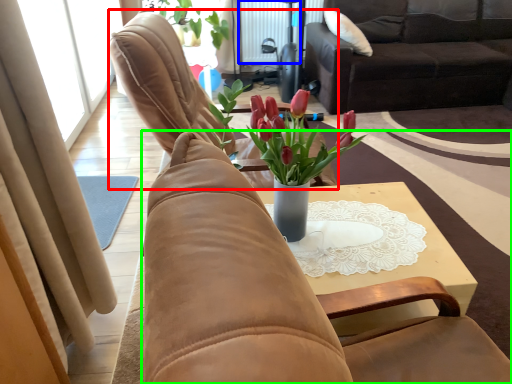
Question: Which object is positioned closest to chair (highlighted by a red box)? Select from radiator (highlighted by a blue box) and chair (highlighted by a green box).

Choices:
 (A) radiator
 (B) chair

Answer: (B)